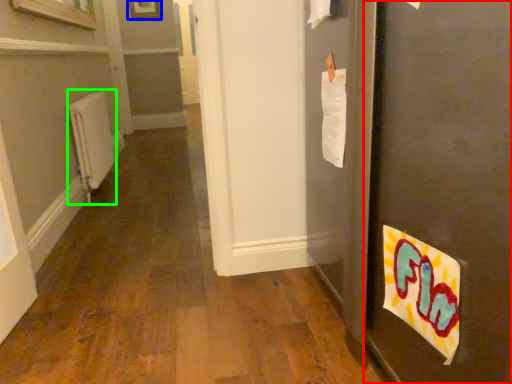
Question: Estimate the real-world distances between objects in this image. Which object is closer to door (highlighted by a red box), picture frame (highlighted by a blue box) or radiator (highlighted by a green box)?

Choices:
 (A) picture frame
 (B) radiator

Answer: (B)